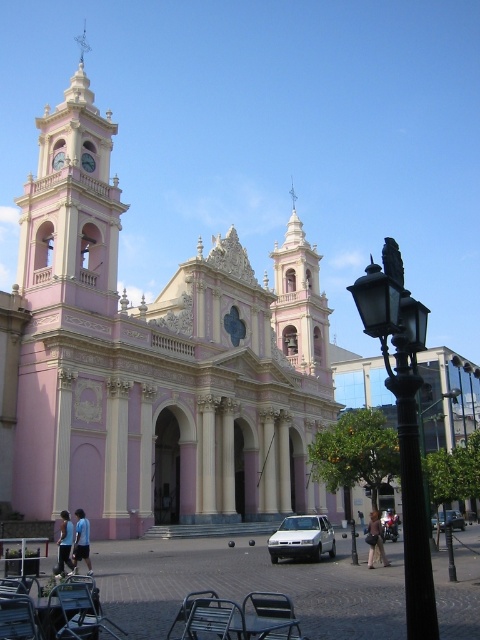
Is pink matte church at center smaller than white matte car at lower center?

Actually, pink matte church at center might be larger than white matte car at lower center.

Is pink matte church at center to the right of white matte car at lower center from the viewer's perspective?

No, pink matte church at center is not to the right of white matte car at lower center.

Who is more distant from viewer, (231, 516) or (278, 538)?

The point (231, 516) is more distant.

In order to click on pink matte church at center in this screenshot , I will do `click(152, 358)`.

Is point (88, 568) more distant than point (365, 538)?

No, (88, 568) is closer to viewer.

Can you confirm if blue fabric shirt at lower left is bigger than light brown leather jacket at lower center?

Incorrect, blue fabric shirt at lower left is not larger than light brown leather jacket at lower center.

Locate an element on the screen. This screenshot has width=480, height=640. blue fabric shirt at lower left is located at coordinates (82, 540).

Who is higher up, white matte car at lower center or silver metallic sedan at center?

white matte car at lower center

Is white matte car at lower center taller than silver metallic sedan at center?

In fact, white matte car at lower center may be shorter than silver metallic sedan at center.

Describe the element at coordinates (301, 538) in the screenshot. I see `white matte car at lower center` at that location.

This screenshot has width=480, height=640. I want to click on white matte car at lower center, so click(x=301, y=538).